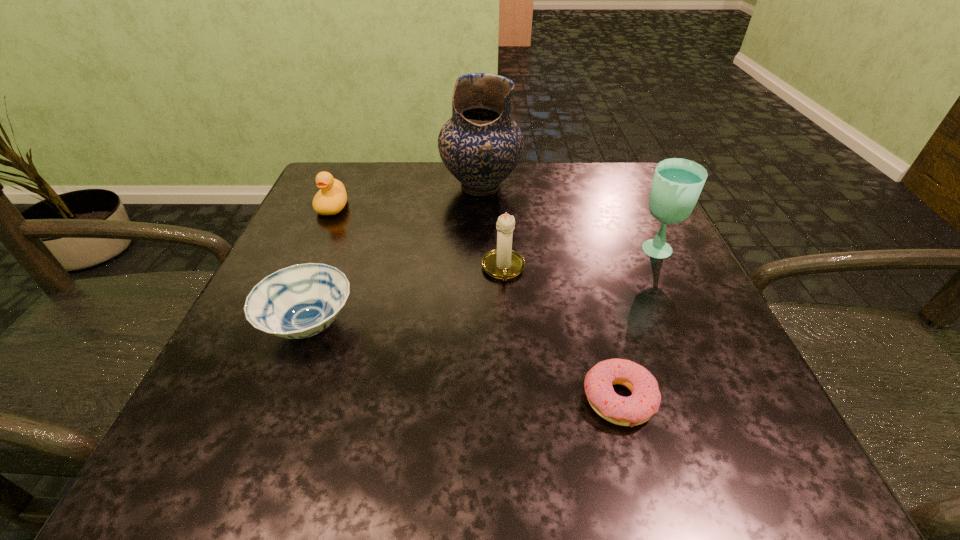
Where is `free space located on the back of the second tallest object`? The width and height of the screenshot is (960, 540). free space located on the back of the second tallest object is located at coordinates (639, 219).

Where is `vacant region located on the handle side of the candle holder`? This screenshot has width=960, height=540. vacant region located on the handle side of the candle holder is located at coordinates (506, 320).

Locate an element on the screen. The width and height of the screenshot is (960, 540). vacant space located 0.360m on the face of the fourth tallest object is located at coordinates (267, 354).

In order to click on free space located 0.140m on the back of the fifth tallest object in this screenshot , I will do `click(341, 244)`.

What are the coordinates of `vacant space located on the left of the doughnut` in the screenshot? It's located at (532, 400).

The width and height of the screenshot is (960, 540). I want to click on pottery present at the far edge, so click(x=480, y=145).

The image size is (960, 540). Identify the location of duck located in the far edge section of the desktop. (331, 198).

Find the location of a particular element. The height and width of the screenshot is (540, 960). object that is positioned at the near edge is located at coordinates (633, 410).

What are the coordinates of `duck that is at the left edge` in the screenshot? It's located at (331, 198).

Identify the location of soup bowl that is at the left edge. (300, 301).